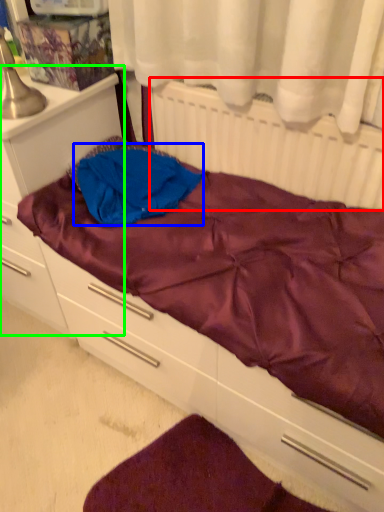
Question: Based on their relative distances, which object is nearer to radiator (highlighted by a red box)? Choose from clothing (highlighted by a blue box) and file cabinet (highlighted by a green box).

Choices:
 (A) clothing
 (B) file cabinet

Answer: (A)